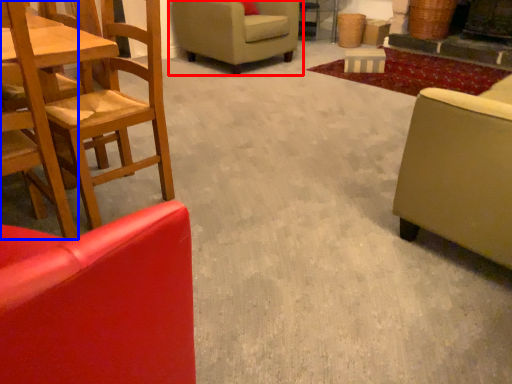
Question: Which of the following is the closest to the observer, chair (highlighted by a red box) or chair (highlighted by a blue box)?

Choices:
 (A) chair
 (B) chair

Answer: (B)